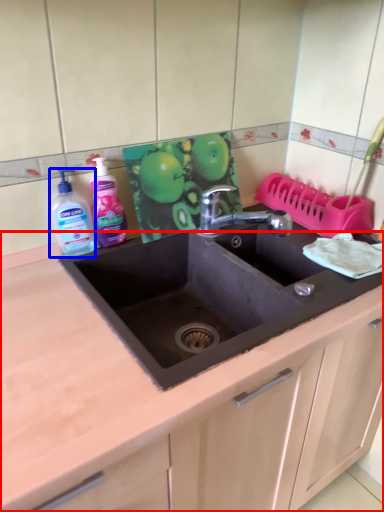
Question: Which object appears farthest to the camera in this image, countertop (highlighted by a red box) or cleaning product (highlighted by a blue box)?

Choices:
 (A) countertop
 (B) cleaning product

Answer: (B)